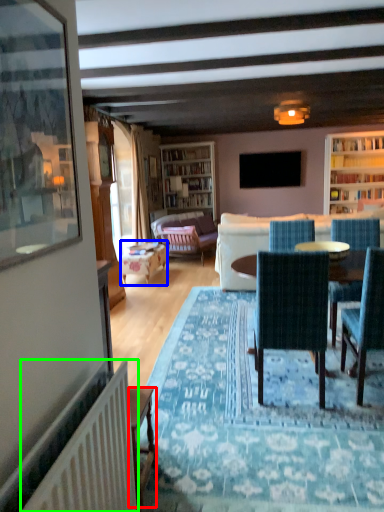
Question: Considering the real-world distances, which object is farthest from desk (highlighted by a red box)? table (highlighted by a blue box) or radiator (highlighted by a green box)?

Choices:
 (A) table
 (B) radiator

Answer: (A)